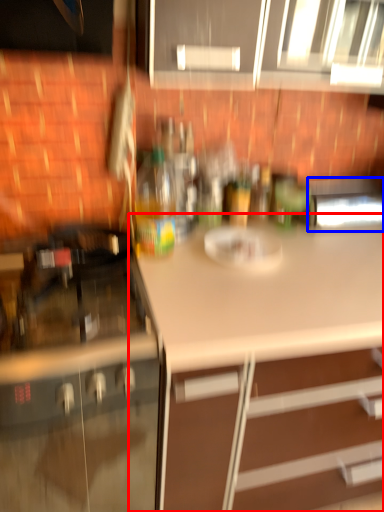
Question: Which of the following is the farthest to the observer, countertop (highlighted by a red box) or appliance (highlighted by a blue box)?

Choices:
 (A) countertop
 (B) appliance

Answer: (B)